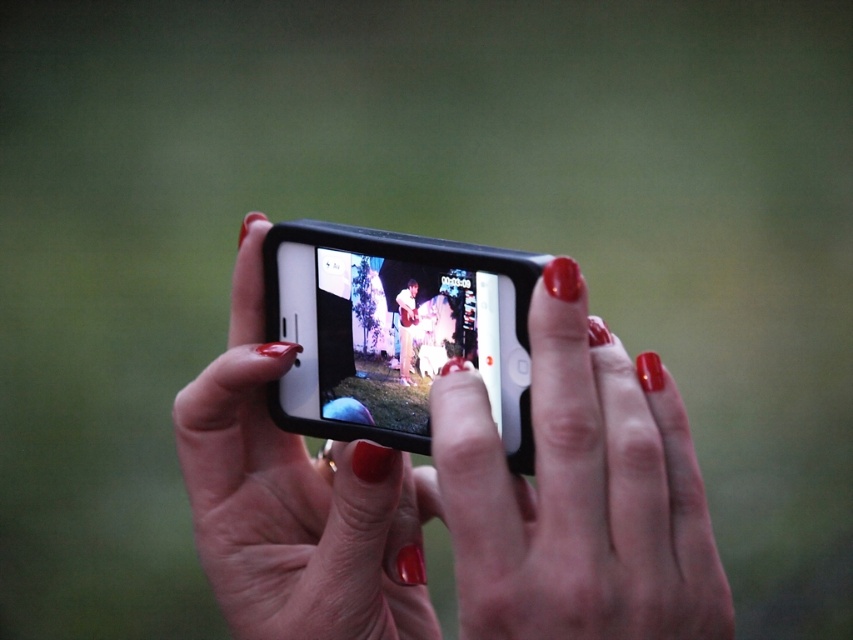
Question: Does glossy red nail polish at center appear on the right side of black matte smartphone at center?

Choices:
 (A) yes
 (B) no

Answer: (A)

Question: Estimate the real-world distances between objects in this image. Which object is closer to the smooth white shirt at center?

Choices:
 (A) matte black phone at center
 (B) black matte smartphone at center

Answer: (B)

Question: Which is farther from the black matte smartphone at center?

Choices:
 (A) glossy red nail polish at center
 (B) matte black phone at center
 (C) smooth white shirt at center

Answer: (A)

Question: Which object is closer to the camera taking this photo?

Choices:
 (A) glossy red nail polish at center
 (B) black matte smartphone at center
 (C) matte black phone at center
 (D) smooth white shirt at center

Answer: (A)

Question: Is glossy red nail polish at center above smooth white shirt at center?

Choices:
 (A) no
 (B) yes

Answer: (A)

Question: Does matte black phone at center lie in front of black matte smartphone at center?

Choices:
 (A) no
 (B) yes

Answer: (B)